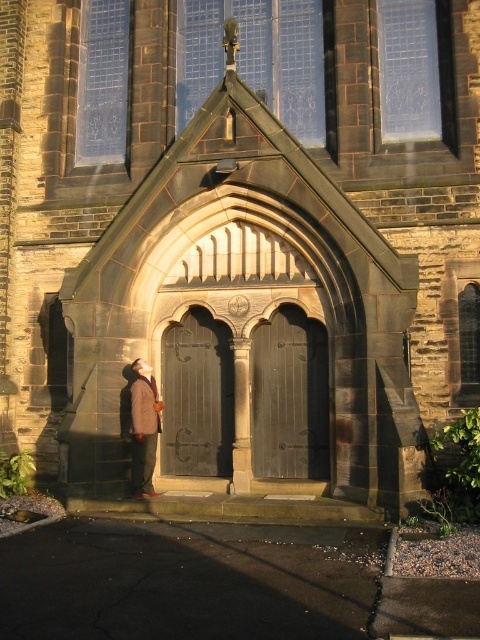
Question: Can you confirm if dark brown wooden door at center is positioned below brown wool coat at lower left?

Choices:
 (A) no
 (B) yes

Answer: (A)

Question: Is dark gray stone door at center closer to the viewer compared to brown wool coat at lower left?

Choices:
 (A) no
 (B) yes

Answer: (A)

Question: Estimate the real-world distances between objects in this image. Which object is farther from the brown wool coat at lower left?

Choices:
 (A) dark brown wooden door at center
 (B) dark gray stone door at center

Answer: (A)

Question: Which object is positioned farthest from the dark brown wooden door at center?

Choices:
 (A) dark gray stone door at center
 (B) brown wool coat at lower left

Answer: (B)

Question: Which object is farther from the camera taking this photo?

Choices:
 (A) dark brown wooden door at center
 (B) brown wool coat at lower left

Answer: (A)

Question: Is dark gray stone door at center in front of brown wool coat at lower left?

Choices:
 (A) yes
 (B) no

Answer: (B)